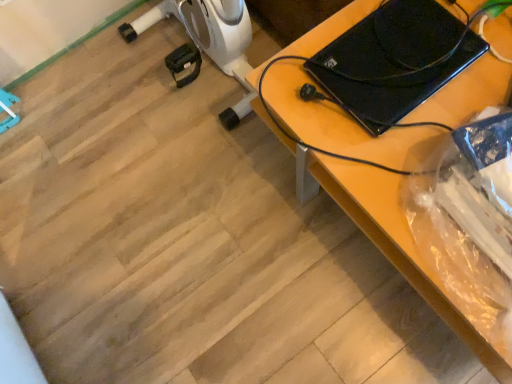
What do you see at coordinates (393, 40) in the screenshot?
I see `black glossy laptop at upper right` at bounding box center [393, 40].

Find the location of a particular element. Image resolution: width=512 pixels, height=384 pixels. black glossy laptop at upper right is located at coordinates (393, 40).

What do you see at coordinates (381, 230) in the screenshot? I see `black plastic laptop at upper right` at bounding box center [381, 230].

You are a GUI agent. You are given a task and a screenshot of the screen. Output one action in this format:
    pyautogui.click(x=<x>, y=<y>)
    Task: Click on the black plastic laptop at upper right
    Image resolution: width=512 pixels, height=384 pixels.
    Given the screenshot: What is the action you would take?
    point(381,230)

This screenshot has height=384, width=512. Identify the location of black glossy laptop at upper right. (393, 40).

Which object is positioned more to the right, black glossy laptop at upper right or black plastic laptop at upper right?

black plastic laptop at upper right is more to the right.

Is black glossy laptop at upper right closer to camera compared to black plastic laptop at upper right?

No, it is not.

Between point (339, 47) and point (474, 6), which one is positioned behind?

The point (339, 47) is farther from the camera.

From the image's perspective, is black glossy laptop at upper right under black plastic laptop at upper right?

No, from the image's perspective, black glossy laptop at upper right is not below black plastic laptop at upper right.

From a real-world perspective, relative to black plastic laptop at upper right, is black glossy laptop at upper right vertically above or below?

black glossy laptop at upper right is situated higher than black plastic laptop at upper right in the real world.

In the scene shown: Considering the sizes of objects black glossy laptop at upper right and black plastic laptop at upper right in the image provided, who is wider, black glossy laptop at upper right or black plastic laptop at upper right?

Wider between the two is black plastic laptop at upper right.

Considering the relative sizes of black glossy laptop at upper right and black plastic laptop at upper right in the image provided, is black glossy laptop at upper right shorter than black plastic laptop at upper right?

Yes, black glossy laptop at upper right is shorter than black plastic laptop at upper right.

Is black glossy laptop at upper right smaller than black plastic laptop at upper right?

Yes, black glossy laptop at upper right is smaller than black plastic laptop at upper right.

Consider the image. Is black glossy laptop at upper right positioned beyond the bounds of black plastic laptop at upper right?

Absolutely, black glossy laptop at upper right is external to black plastic laptop at upper right.

Are black glossy laptop at upper right and black plastic laptop at upper right located far from each other?

That's not correct — black glossy laptop at upper right is a little close to black plastic laptop at upper right.

Is black glossy laptop at upper right aimed at black plastic laptop at upper right?

No, black glossy laptop at upper right is not turned towards black plastic laptop at upper right.

Locate an element on the screen. This screenshot has height=384, width=512. desk located underneath the black glossy laptop at upper right (from a real-world perspective) is located at coordinates (381, 230).

Considering the positions of objects black plastic laptop at upper right and black glossy laptop at upper right in the image provided, who is more to the right, black plastic laptop at upper right or black glossy laptop at upper right?

From the viewer's perspective, black plastic laptop at upper right appears more on the right side.

Between black plastic laptop at upper right and black glossy laptop at upper right, which one is positioned behind?

Positioned behind is black glossy laptop at upper right.

Does point (375, 201) come behind point (385, 17)?

No, it is in front of (385, 17).

From the image's perspective, would you say black plastic laptop at upper right is positioned over black glossy laptop at upper right?

No, from the image's perspective, black plastic laptop at upper right is not above black glossy laptop at upper right.

From a real-world perspective, is black plastic laptop at upper right under black glossy laptop at upper right?

Yes, from a real-world perspective, black plastic laptop at upper right is under black glossy laptop at upper right.

Considering the sizes of objects black plastic laptop at upper right and black glossy laptop at upper right in the image provided, who is wider, black plastic laptop at upper right or black glossy laptop at upper right?

black plastic laptop at upper right is wider.

Which of these two, black plastic laptop at upper right or black glossy laptop at upper right, stands shorter?

Standing shorter between the two is black glossy laptop at upper right.

Between black plastic laptop at upper right and black glossy laptop at upper right, which one has larger size?

black plastic laptop at upper right.

Is black plastic laptop at upper right outside of black glossy laptop at upper right?

Absolutely, black plastic laptop at upper right is external to black glossy laptop at upper right.

Is black plastic laptop at upper right far away from black glossy laptop at upper right?

black plastic laptop at upper right is actually quite close to black glossy laptop at upper right.

From the picture: Could you tell me if black plastic laptop at upper right is turned towards black glossy laptop at upper right?

No, black plastic laptop at upper right does not turn towards black glossy laptop at upper right.

Can you tell me how much black plastic laptop at upper right and black glossy laptop at upper right differ in facing direction?

90 degrees.

You are a GUI agent. You are given a task and a screenshot of the screen. Output one action in this format:
    pyautogui.click(x=<x>, y=<y>)
    Task: Click on the laptop on the left of the black plastic laptop at upper right
    
    Given the screenshot: What is the action you would take?
    pyautogui.click(x=393, y=40)

Where is `laptop above the black plastic laptop at upper right (from the image's perspective)`? laptop above the black plastic laptop at upper right (from the image's perspective) is located at coordinates (393, 40).

Locate an element on the screen. The image size is (512, 384). desk below the black glossy laptop at upper right (from the image's perspective) is located at coordinates (381, 230).